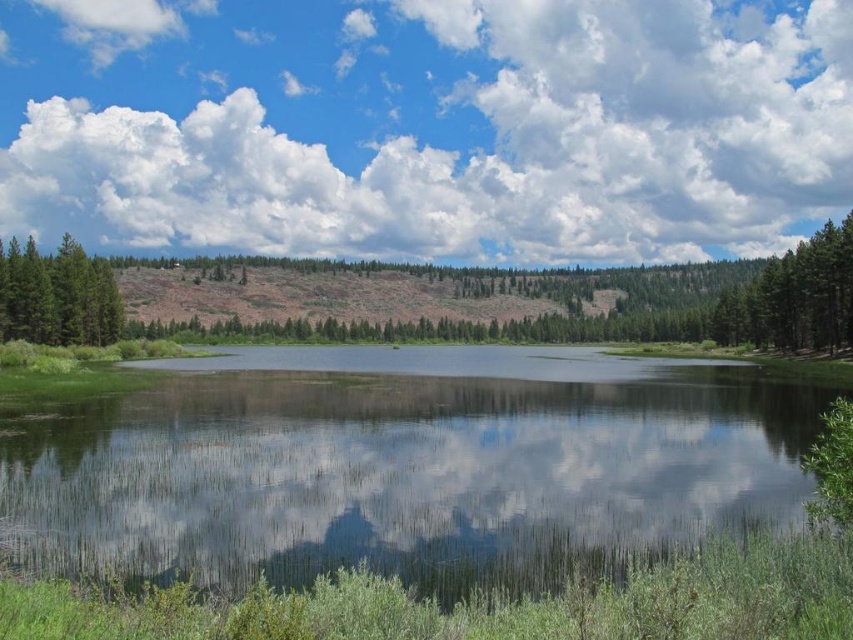
Which is above, green grassy lake at center or green matte tree at left?

green matte tree at left is higher up.

Is point (393, 419) positioned behind point (44, 337)?

No, it is in front of (44, 337).

Which is in front, point (397, 388) or point (27, 323)?

Point (397, 388) is more forward.

The image size is (853, 640). Identify the location of green grassy lake at center. (404, 465).

Between cloudy sky at upper center and green grassy lake at center, which one appears on the left side from the viewer's perspective?

Positioned to the left is green grassy lake at center.

Can you confirm if cloudy sky at upper center is wider than green grassy lake at center?

Correct, the width of cloudy sky at upper center exceeds that of green grassy lake at center.

Between point (521, 99) and point (793, 392), which one is positioned in front?

Point (793, 392) is in front.

What are the coordinates of `cloudy sky at upper center` in the screenshot? It's located at (427, 125).

Is cloudy sky at upper center bigger than green matte tree at left?

Yes, cloudy sky at upper center is bigger than green matte tree at left.

Does cloudy sky at upper center have a lesser height compared to green matte tree at left?

Incorrect, cloudy sky at upper center's height does not fall short of green matte tree at left's.

Does point (198, 196) lie in front of point (32, 269)?

No, it is behind (32, 269).

This screenshot has height=640, width=853. In order to click on cloudy sky at upper center in this screenshot , I will do (427, 125).